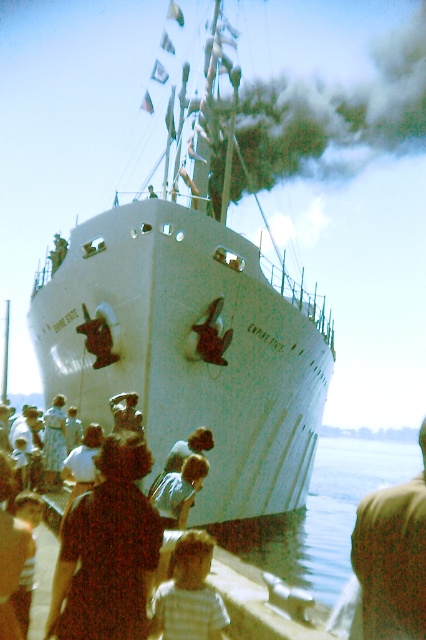
Can you confirm if clear water at lower center is wider than light brown fabric shirt at center?

Yes.

Is clear water at lower center below light brown fabric shirt at center?

Indeed, clear water at lower center is positioned under light brown fabric shirt at center.

Does point (328, 545) come closer to viewer compared to point (184, 528)?

No, it is not.

Identify the location of clear water at lower center. (321, 515).

Describe the element at coordinates (393, 557) in the screenshot. I see `brown fabric at lower right` at that location.

Is brown fabric at lower right below light brown fabric shirt at center?

Correct, brown fabric at lower right is located below light brown fabric shirt at center.

Does point (388, 550) come closer to viewer compared to point (186, 460)?

That is True.

What are the coordinates of `brown fabric at lower right` in the screenshot? It's located at (393, 557).

Which of these two, white matte ship at center or clear water at lower center, stands shorter?

With less height is clear water at lower center.

Measure the distance from white matte ship at center to clear water at lower center.

The distance of white matte ship at center from clear water at lower center is 38.81 meters.

Where is `white matte ship at center`? The image size is (426, 640). white matte ship at center is located at coordinates (195, 310).

Locate an element on the screen. The width and height of the screenshot is (426, 640). white matte ship at center is located at coordinates (195, 310).